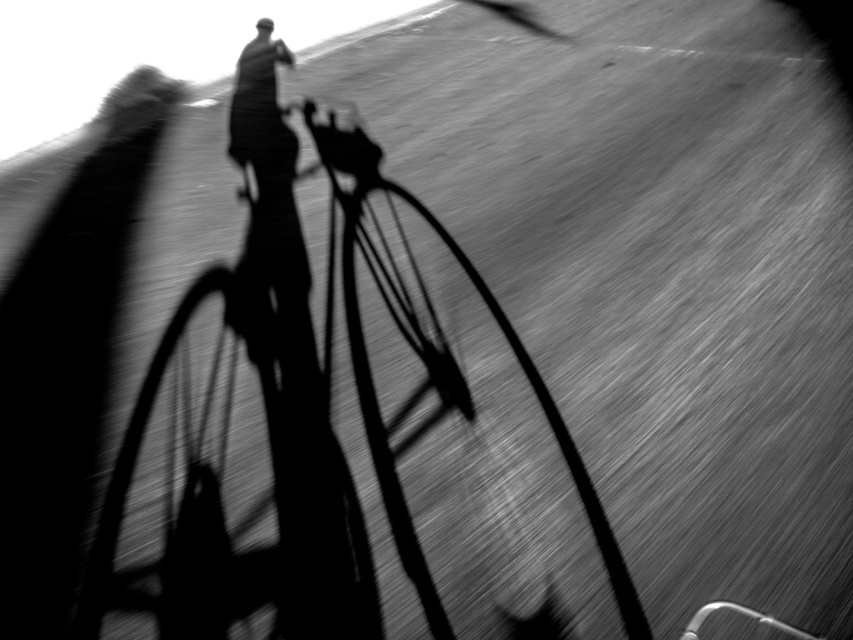
You are a photographer analyzing this image. You notice two points in the scene at coordinates point (91, 625) and point (358, 209). Based on their positions, which point is nearer to the camera?

Point (91, 625) is closer to the camera than point (358, 209).

You are analyzing the position of the smooth black wheel at center in the image. What are the coordinates of its location?

The smooth black wheel at center is located at point (222, 486).